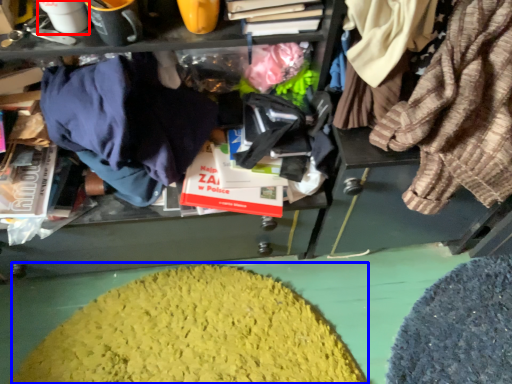
Question: Which object appears farthest to the camera in this image, coffee cup (highlighted by a red box) or debris (highlighted by a blue box)?

Choices:
 (A) coffee cup
 (B) debris

Answer: (B)